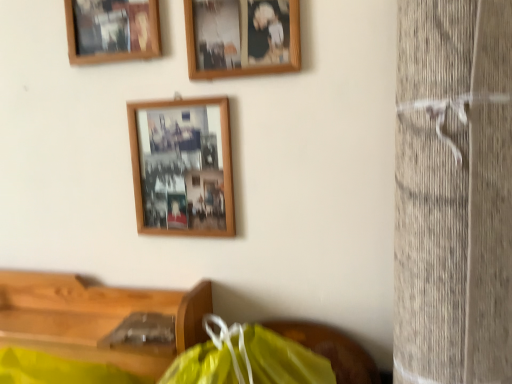
Question: Is wooden table at lower left turned away from wooden photo frame at upper center, the second picture frame when ordered from top to bottom?

Choices:
 (A) no
 (B) yes

Answer: (A)

Question: Is wooden photo frame at upper center, positioned as the 2th picture frame in bottom-to-top order, a part of wooden table at lower left?

Choices:
 (A) yes
 (B) no

Answer: (B)

Question: Does wooden table at lower left come in front of wooden photo frame at upper center, the second picture frame when ordered from top to bottom?

Choices:
 (A) yes
 (B) no

Answer: (A)

Question: Can you confirm if wooden table at lower left is bigger than wooden photo frame at upper center, positioned as the 2th picture frame in bottom-to-top order?

Choices:
 (A) no
 (B) yes

Answer: (B)

Question: From the image's perspective, does wooden table at lower left appear lower than wooden photo frame at upper center, positioned as the 2th picture frame in bottom-to-top order?

Choices:
 (A) no
 (B) yes

Answer: (B)

Question: Considering the positions of wooden photo frame at upper center, the second picture frame when ordered from top to bottom, and wooden picture frame at upper left, acting as the 1th picture frame starting from the top, in the image, is wooden photo frame at upper center, the second picture frame when ordered from top to bottom, taller or shorter than wooden picture frame at upper left, acting as the 1th picture frame starting from the top,?

Choices:
 (A) tall
 (B) short

Answer: (B)

Question: Visually, is wooden photo frame at upper center, the second picture frame when ordered from top to bottom, positioned to the left or to the right of wooden picture frame at upper left, positioned as the 3th picture frame in bottom-to-top order?

Choices:
 (A) right
 (B) left

Answer: (A)

Question: From the image's perspective, is wooden photo frame at upper center, the second picture frame when ordered from top to bottom, above or below wooden picture frame at upper left, acting as the 1th picture frame starting from the top?

Choices:
 (A) above
 (B) below

Answer: (B)

Question: Is point (296, 44) positioned closer to the camera than point (156, 29)?

Choices:
 (A) farther
 (B) closer

Answer: (B)

Question: From their relative heights in the image, would you say wooden picture frame at upper left, positioned as the 3th picture frame in bottom-to-top order, is taller or shorter than wooden photo frame at upper center, the second picture frame when ordered from top to bottom?

Choices:
 (A) short
 (B) tall

Answer: (B)

Question: From a real-world perspective, relative to wooden photo frame at upper center, the second picture frame when ordered from top to bottom, is wooden picture frame at upper left, acting as the 1th picture frame starting from the top, vertically above or below?

Choices:
 (A) below
 (B) above

Answer: (B)

Question: Do you think wooden picture frame at upper left, positioned as the 3th picture frame in bottom-to-top order, is within wooden photo frame at upper center, positioned as the 2th picture frame in bottom-to-top order, or outside of it?

Choices:
 (A) inside
 (B) outside

Answer: (B)

Question: Is wooden picture frame at upper left, acting as the 1th picture frame starting from the top, wider or thinner than wooden photo frame at upper center, positioned as the 2th picture frame in bottom-to-top order?

Choices:
 (A) wide
 (B) thin

Answer: (A)

Question: Which is correct: wooden picture frame at upper left, positioned as the 3th picture frame in bottom-to-top order, is inside wooden photo frame at center, the first picture frame positioned from the bottom, or outside of it?

Choices:
 (A) inside
 (B) outside

Answer: (B)

Question: Would you say wooden picture frame at upper left, acting as the 1th picture frame starting from the top, is to the left or to the right of wooden photo frame at center, which appears as the third picture frame when viewed from the top, in the picture?

Choices:
 (A) right
 (B) left

Answer: (B)